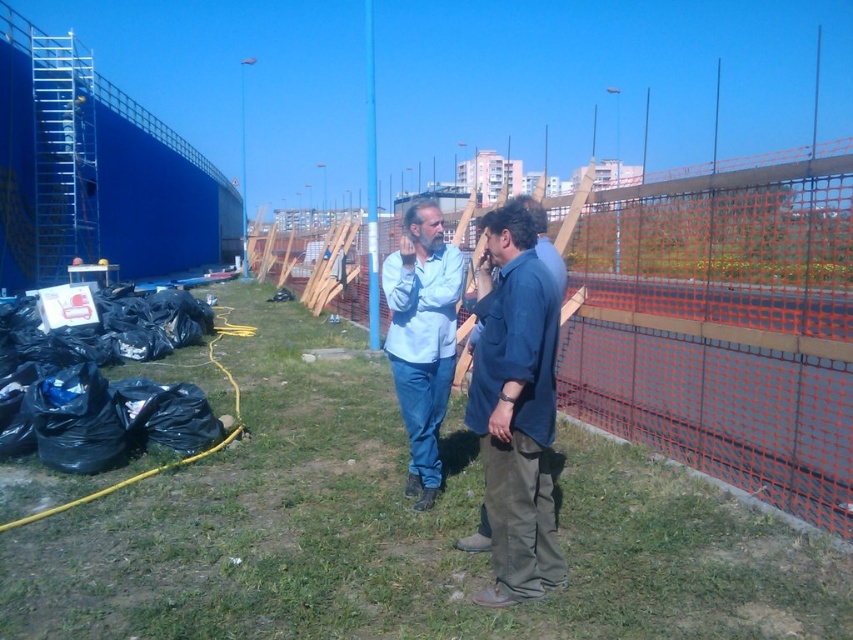
Can you confirm if green grass at center is taller than light blue shirt at center?

In fact, green grass at center may be shorter than light blue shirt at center.

Between point (837, 614) and point (440, 323), which one is positioned behind?

The point (440, 323) is more distant.

I want to click on green grass at center, so click(397, 531).

Looking at this image, does orange mesh fence at center have a lesser height compared to light blue shirt at center?

Correct, orange mesh fence at center is not as tall as light blue shirt at center.

Between orange mesh fence at center and light blue shirt at center, which one has less height?

Standing shorter between the two is orange mesh fence at center.

Between point (607, 280) and point (404, 230), which one is positioned in front?

Point (404, 230) is in front.

Locate an element on the screen. This screenshot has height=640, width=853. orange mesh fence at center is located at coordinates (720, 324).

Between point (140, 508) and point (479, 548), which one is positioned in front?

Point (479, 548)

Is green grass at center smaller than blue cotton shirt at center?

Actually, green grass at center might be larger than blue cotton shirt at center.

Between point (709, 589) and point (474, 547), which one is positioned in front?

Point (709, 589) is more forward.

This screenshot has height=640, width=853. What are the coordinates of `green grass at center` in the screenshot? It's located at (397, 531).